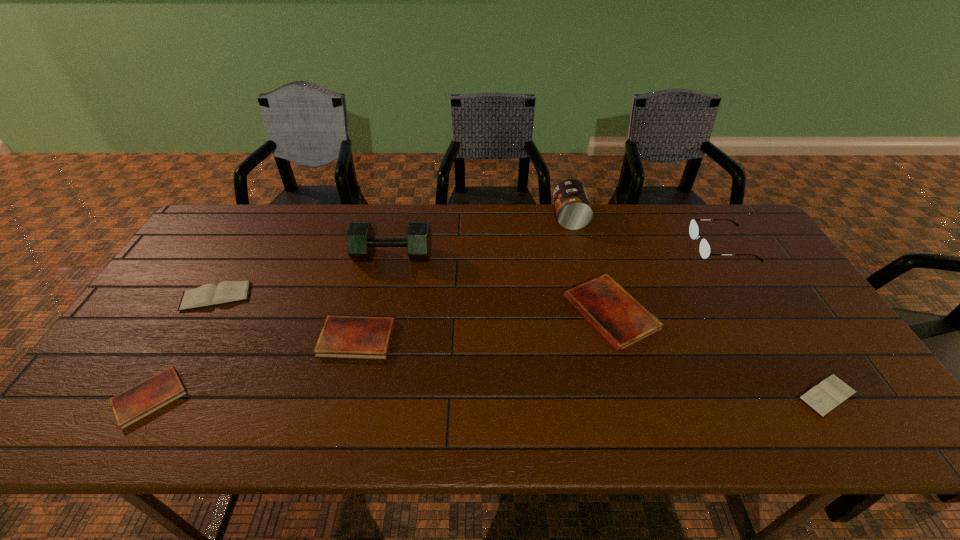
Where is `diary situated at the right edge`? The height and width of the screenshot is (540, 960). diary situated at the right edge is located at coordinates (830, 393).

Identify the location of object present at the near left corner. (141, 400).

This screenshot has width=960, height=540. I want to click on object that is at the far right corner, so click(705, 250).

You are a GUI agent. You are given a task and a screenshot of the screen. Output one action in this format:
    pyautogui.click(x=<x>, y=<y>)
    Task: Click on the object present at the near right corner
    Image resolution: width=960 pixels, height=540 pixels.
    Given the screenshot: What is the action you would take?
    pyautogui.click(x=830, y=393)

In the image, there is a desktop. Where is `free space at the far edge`? This screenshot has width=960, height=540. free space at the far edge is located at coordinates 272,206.

In the image, there is a desktop. Where is `vacant region at the near edge`? vacant region at the near edge is located at coordinates (463, 418).

In the image, there is a desktop. Where is `free space at the left edge`? free space at the left edge is located at coordinates (134, 336).

This screenshot has height=540, width=960. In order to click on vacant space at the right edge of the desktop in this screenshot , I will do `click(746, 292)`.

What are the coordinates of `vacant space at the near right corner of the desktop` in the screenshot? It's located at (867, 421).

The width and height of the screenshot is (960, 540). Identify the location of empty location between the rightmost diary and the fourth diary from left to right. (719, 354).